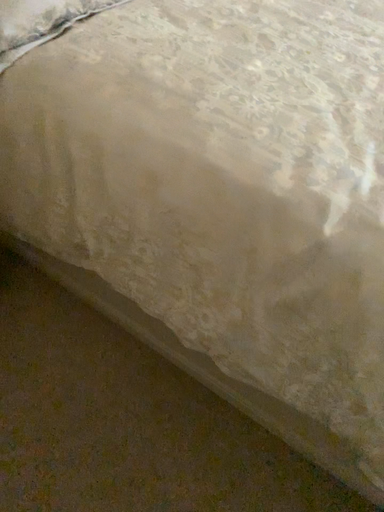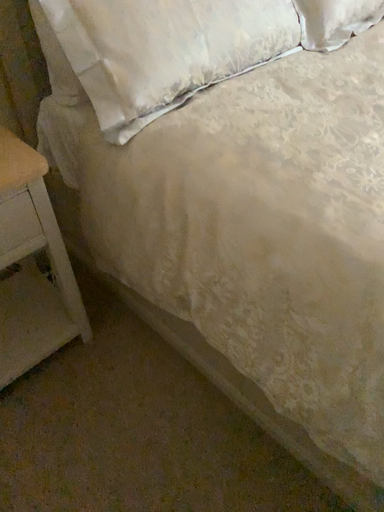
Question: How did the camera likely rotate when shooting the video?

Choices:
 (A) rotated right
 (B) rotated left

Answer: (B)